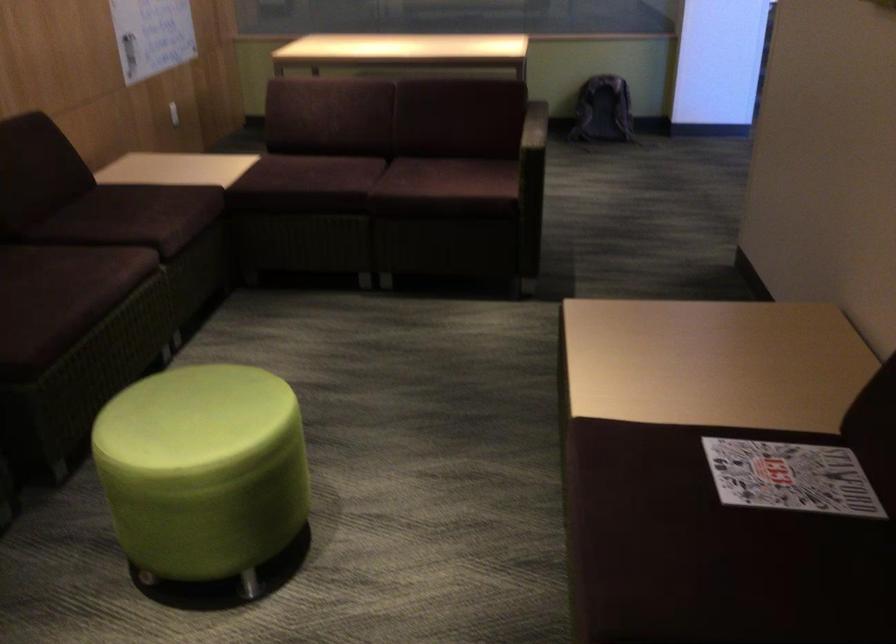
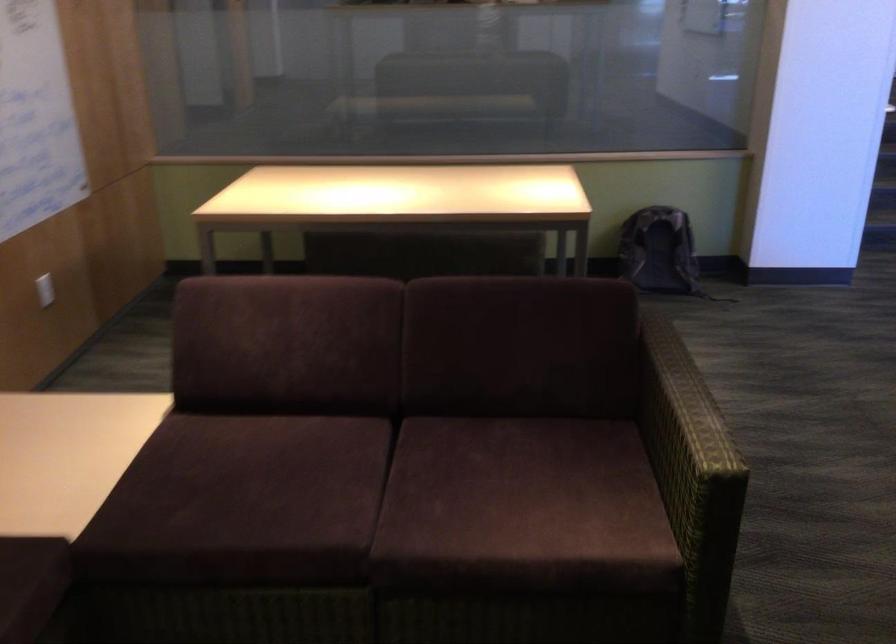
Find the pixel in the second image that matches [179,102] in the first image.

(45, 289)